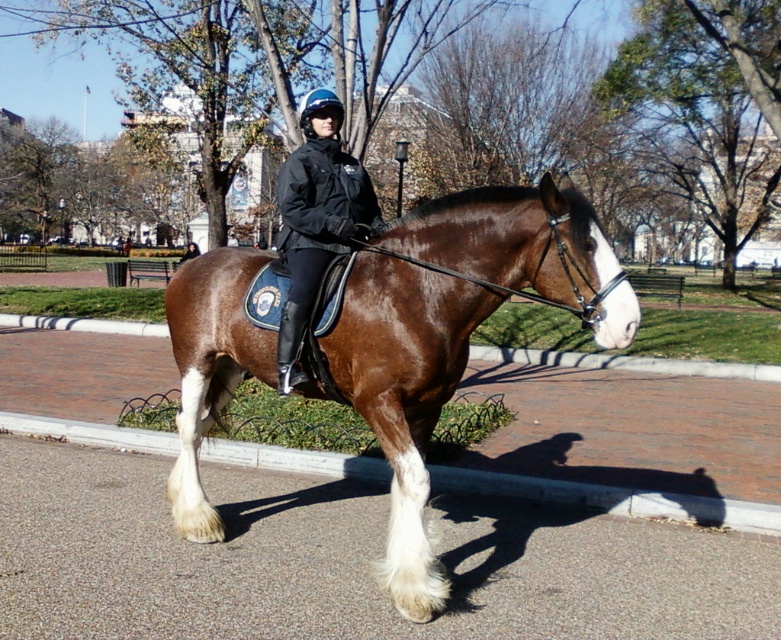
Question: Is brown glossy horse at center smaller than black leather jacket at center?

Choices:
 (A) yes
 (B) no

Answer: (B)

Question: Can you confirm if brown glossy horse at center is positioned above black leather jacket at center?

Choices:
 (A) no
 (B) yes

Answer: (A)

Question: Is brown glossy horse at center wider than black leather jacket at center?

Choices:
 (A) no
 (B) yes

Answer: (B)